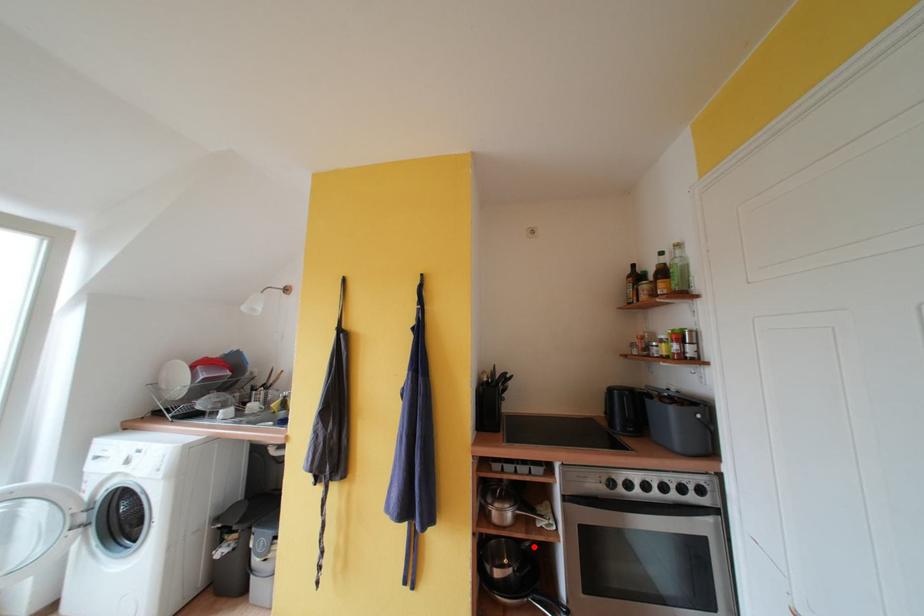
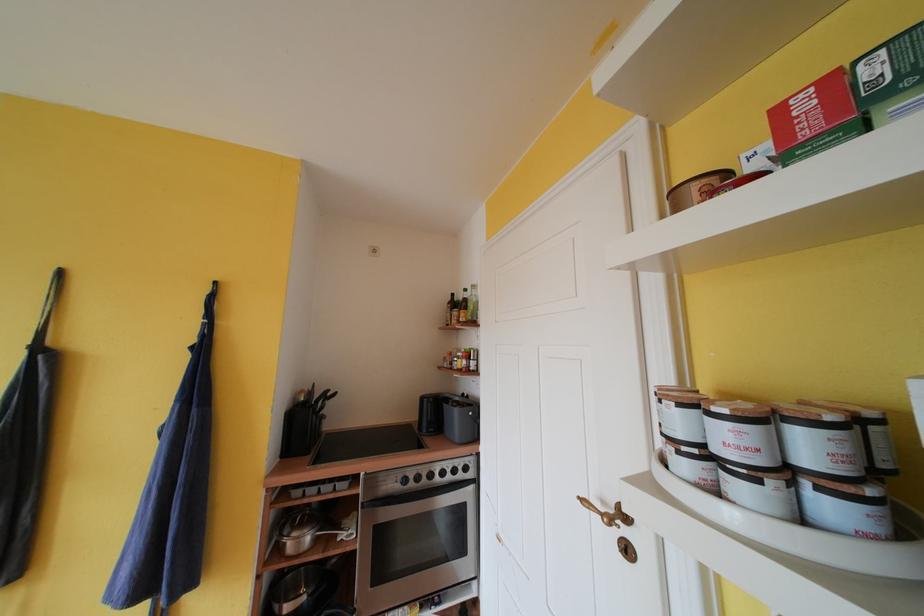
Where in the second image is the point corresponding to the highlighted location from the first image?

(341, 564)